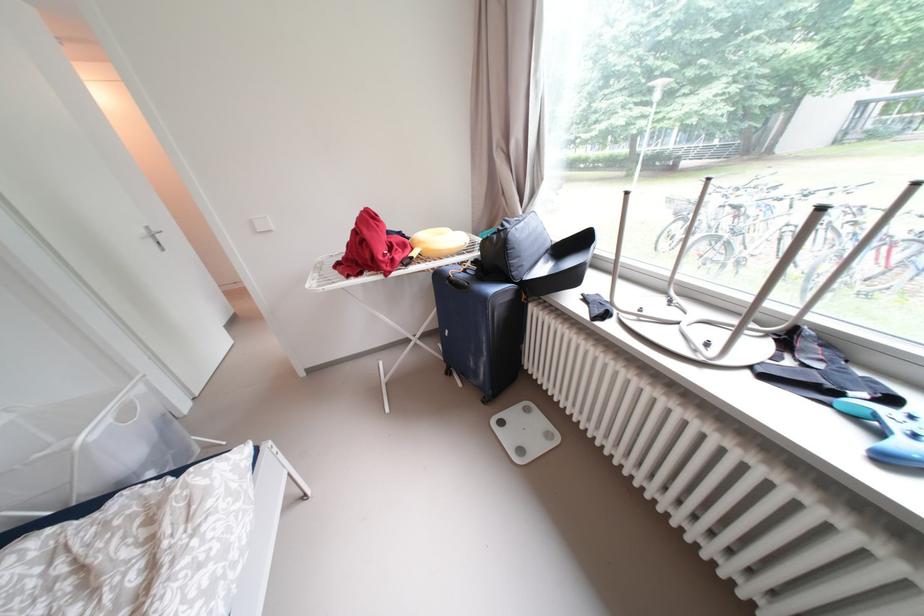
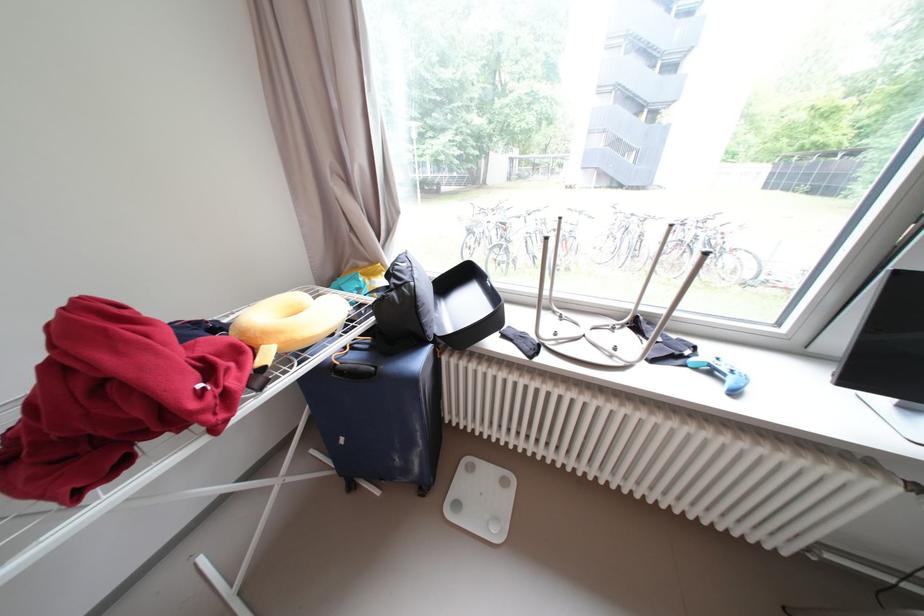
The point at [526,272] is marked in the first image. Where is the corresponding point in the second image?

(439, 328)